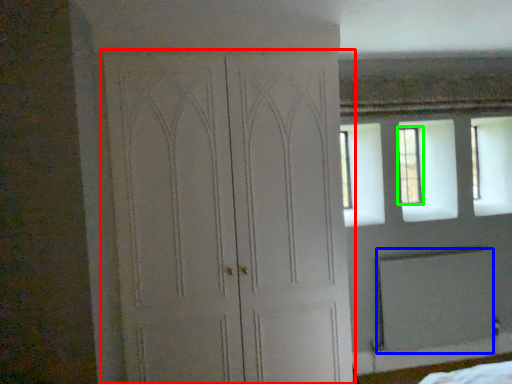
Question: Which object is positioned farthest from door (highlighted by a red box)? Select from screen door (highlighted by a blue box) and window (highlighted by a green box).

Choices:
 (A) screen door
 (B) window

Answer: (B)